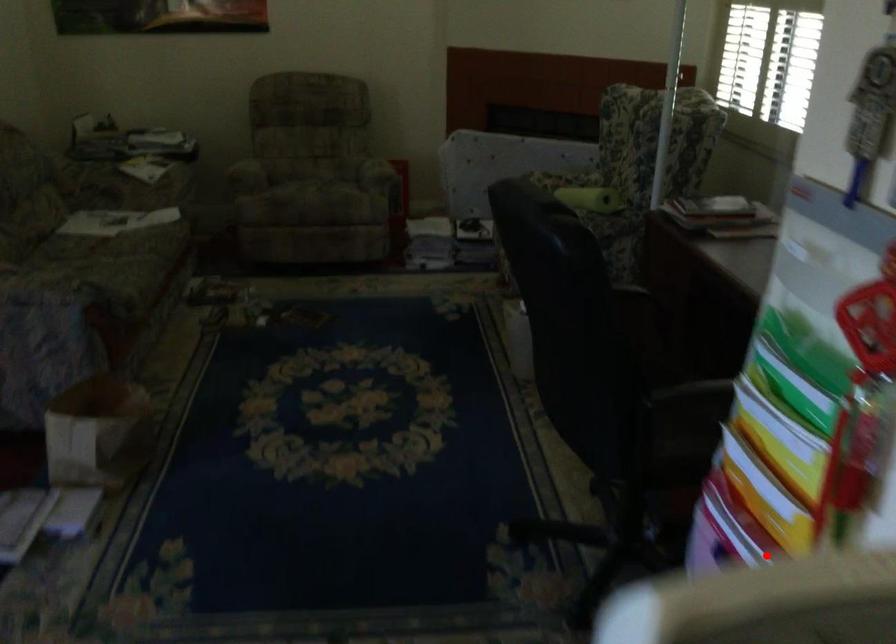
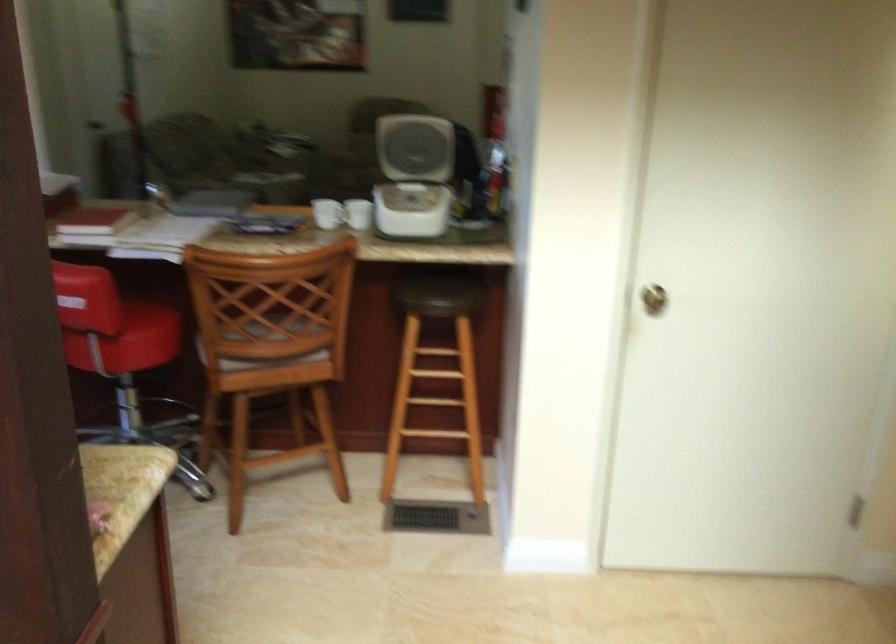
In the second image, find the point that corresponds to the highlighted location in the first image.

(416, 137)